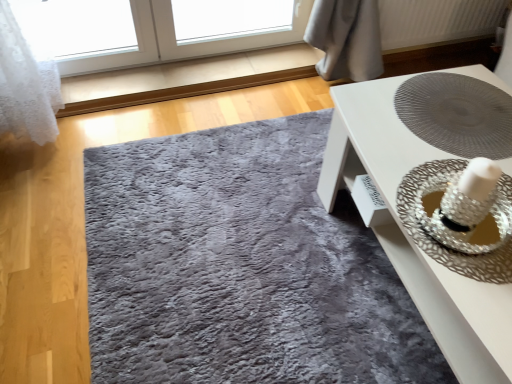
Identify the location of free spot above silver metallic straw hat at right (from a real-world perspective). (443, 214).